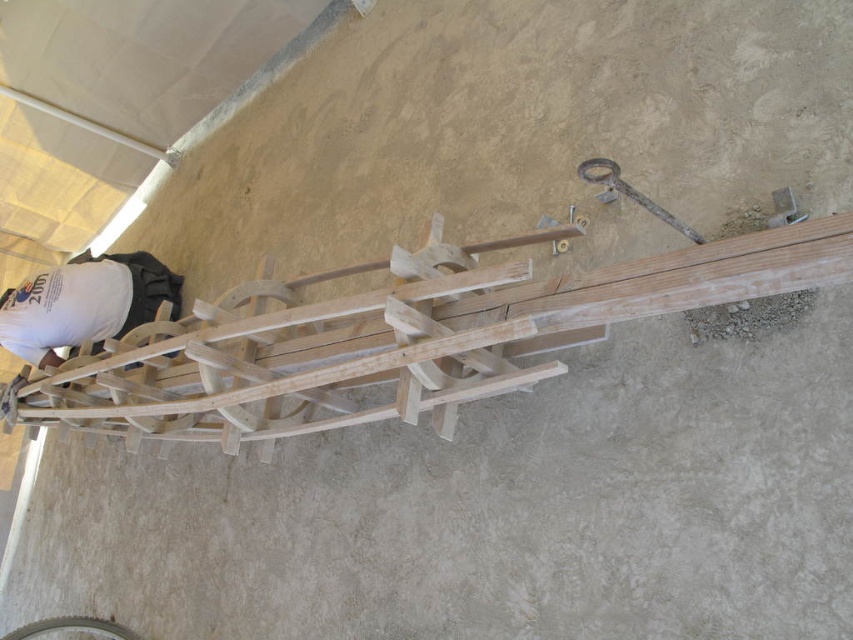
You are a safety inspector at the construction site. You need to ensure that the natural wood rail at center is tall enough to meet safety standards. According to the description, how does its height compare to the white matte shirt at upper left?

The natural wood rail at center has a greater height compared to the white matte shirt at upper left, so it meets the safety standard requirement.

You are a safety inspector on the construction site. You need to ensure that the natural wood rail at center and the white matte shirt at upper left are at least 24 inches apart for safety regulations. Based on the image, are they compliant?

The natural wood rail at center and the white matte shirt at upper left are 24.83 inches apart from each other, which exceeds the required 24 inches. Therefore, they are compliant with the safety regulations.